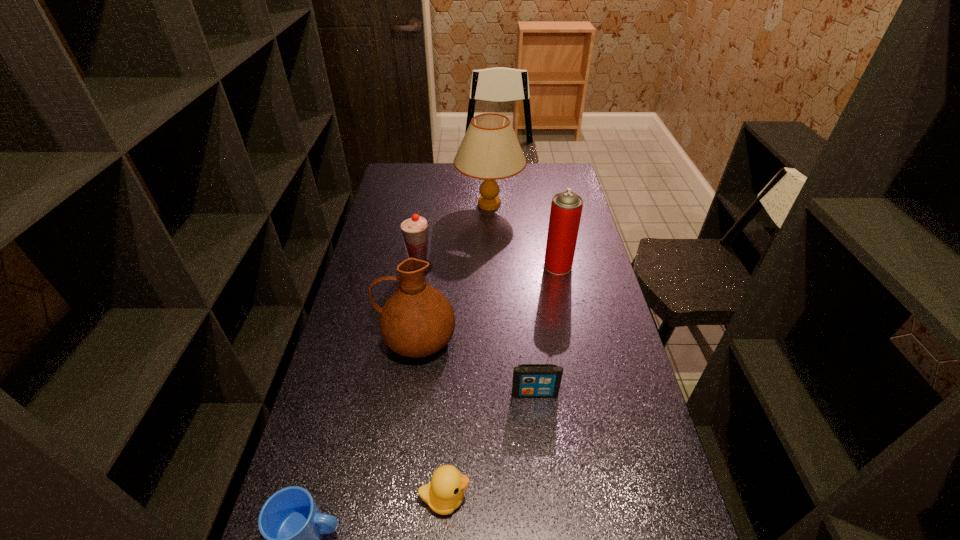
The width and height of the screenshot is (960, 540). What are the coordinates of `vacant space located on the front of the smoothie` in the screenshot? It's located at (415, 295).

At what (x,y) coordinates should I click in order to perform the action: click on vacant space located 0.120m on the front screen of the iPod. Please return your answer as a coordinate pair (x, y). The height and width of the screenshot is (540, 960). Looking at the image, I should click on (540, 438).

You are a GUI agent. You are given a task and a screenshot of the screen. Output one action in this format:
    pyautogui.click(x=<x>, y=<y>)
    Task: Click on the free location located 0.180m on the face of the duck
    The width and height of the screenshot is (960, 540).
    Given the screenshot: What is the action you would take?
    pyautogui.click(x=547, y=498)

Locate an element on the screen. This screenshot has width=960, height=540. object located at the far edge is located at coordinates (490, 151).

Identify the location of object that is at the left edge. pyautogui.click(x=417, y=320).

Image resolution: width=960 pixels, height=540 pixels. Find the location of `object situated at the right edge`. object situated at the right edge is located at coordinates (566, 207).

Where is `vacant region at the far edge of the desktop`? The image size is (960, 540). vacant region at the far edge of the desktop is located at coordinates (421, 184).

This screenshot has width=960, height=540. In the image, there is a desktop. What are the coordinates of `vacant space at the left edge` in the screenshot? It's located at (404, 194).

In order to click on vacant region at the right edge in this screenshot , I will do `click(581, 302)`.

The height and width of the screenshot is (540, 960). I want to click on vacant region at the far right corner of the desktop, so click(x=560, y=181).